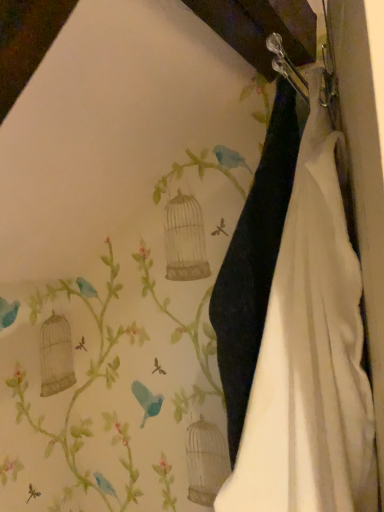
What do you see at coordinates (310, 357) in the screenshot? I see `white fabric at right` at bounding box center [310, 357].

The image size is (384, 512). I want to click on white fabric at right, so click(310, 357).

At what (x,y) coordinates should I click in order to perform the action: click on white fabric at right. Please return your answer as a coordinate pair (x, y). Looking at the image, I should click on (310, 357).